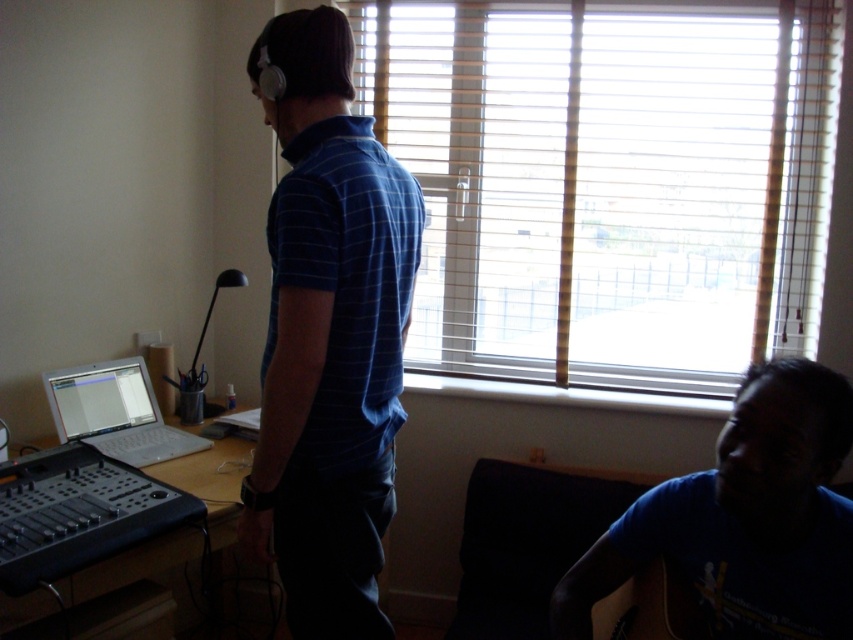
Please look at the image. There is a point at coordinate [612,180]. What object is located at that point?

The wooden blinds at upper center is located at point [612,180].

You are organizing a clothing store and need to arrange the blue plaid shirt at center and the blue cotton shirt at lower right on a shelf. According to their positions in the image, which shirt should be placed to the left of the other?

The blue plaid shirt at center should be placed to the left of the blue cotton shirt at lower right because in the image, the blue plaid shirt at center is positioned on the left side of blue cotton shirt at lower right.